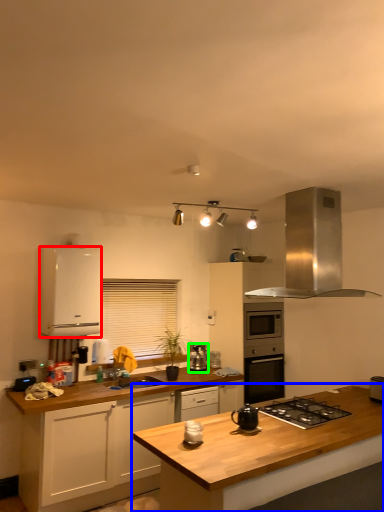
Question: Which object is positioned farthest from cabinetry (highlighted by a red box)? Select from countertop (highlighted by a blue box) and kitchen appliance (highlighted by a green box).

Choices:
 (A) countertop
 (B) kitchen appliance

Answer: (A)